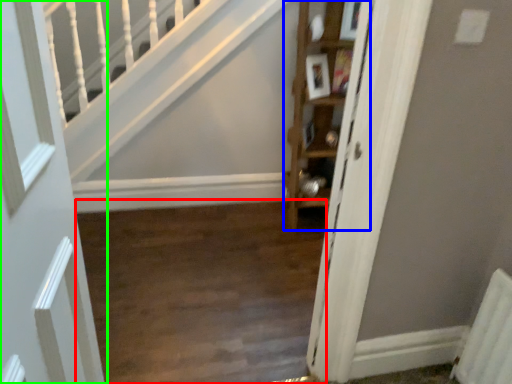
Question: Which object is the farthest from corridor (highlighted by a red box)? Choose among these: cabinet (highlighted by a blue box) or door (highlighted by a green box).

Choices:
 (A) cabinet
 (B) door

Answer: (B)